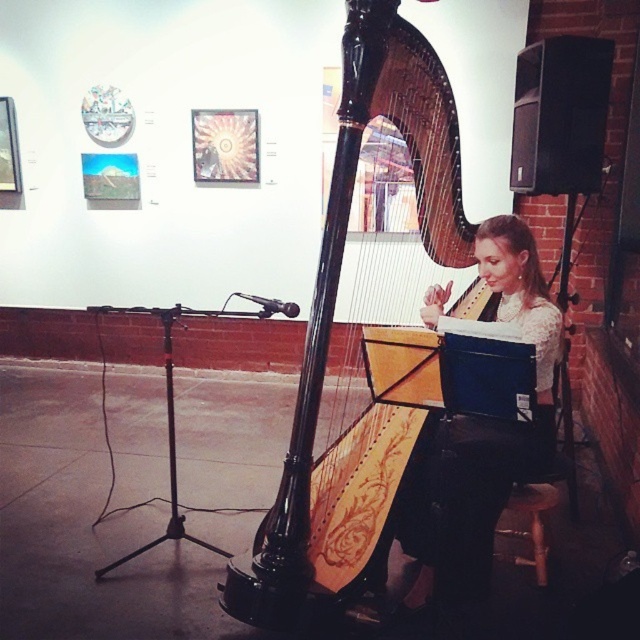
How much distance is there between black polished wood harp at center and wooden stool at lower right?

black polished wood harp at center and wooden stool at lower right are 4.87 feet apart.

Between black polished wood harp at center and wooden stool at lower right, which one is positioned higher?

Positioned higher is black polished wood harp at center.

Identify the location of black polished wood harp at center. This screenshot has width=640, height=640. (362, 333).

Find the location of `black polished wood harp at center`. black polished wood harp at center is located at coordinates (362, 333).

Is black polished wood harp at center wider than matte black harpist at center?

Yes, black polished wood harp at center is wider than matte black harpist at center.

Does black polished wood harp at center have a smaller size compared to matte black harpist at center?

Actually, black polished wood harp at center might be larger than matte black harpist at center.

Locate an element on the screen. The height and width of the screenshot is (640, 640). black polished wood harp at center is located at coordinates pyautogui.click(x=362, y=333).

Is the position of matte black harpist at center more distant than that of wooden stool at lower right?

No, matte black harpist at center is closer to the viewer.

Which is below, matte black harpist at center or wooden stool at lower right?

Positioned lower is wooden stool at lower right.

Who is more distant from viewer, (556, 316) or (508, 556)?

The point (508, 556) is more distant.

You are a GUI agent. You are given a task and a screenshot of the screen. Output one action in this format:
    pyautogui.click(x=<x>, y=<y>)
    Task: Click on the matte black harpist at center
    This screenshot has width=640, height=640.
    Given the screenshot: What is the action you would take?
    pyautogui.click(x=486, y=428)